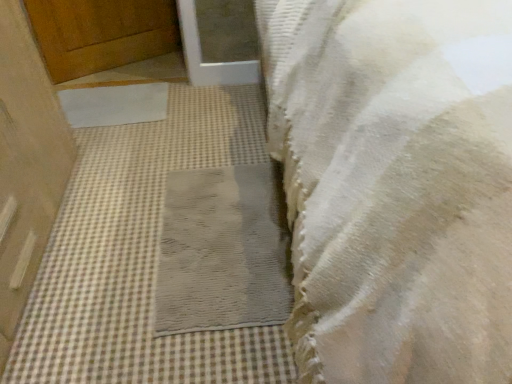
I want to click on vacant space behind wooden door at left, acting as the first door starting from the front, so click(x=130, y=143).